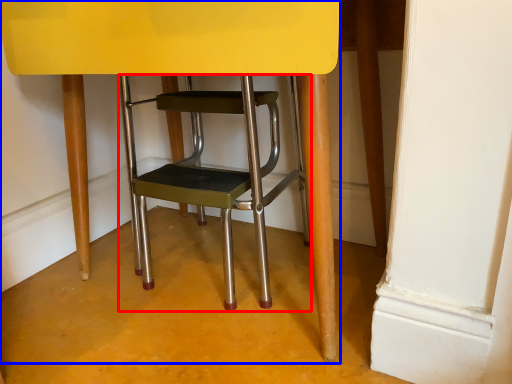
Question: Which object is further to the camera taking this photo, stool (highlighted by a red box) or chair (highlighted by a blue box)?

Choices:
 (A) stool
 (B) chair

Answer: (A)